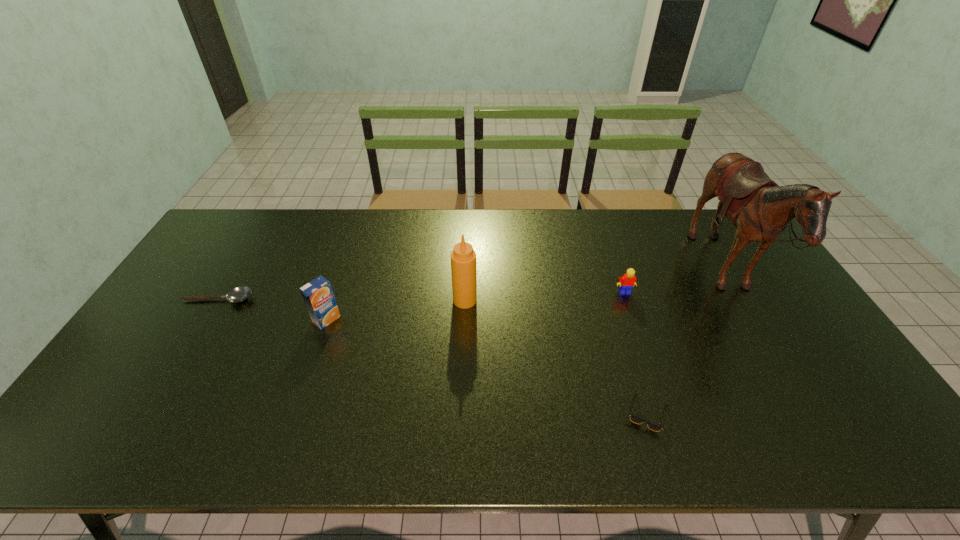
Identify the location of saddle. The height and width of the screenshot is (540, 960). (760, 209).

Find the location of a particular element. The width and height of the screenshot is (960, 540). the rightmost object is located at coordinates (760, 209).

In order to click on condiment in this screenshot , I will do `click(463, 258)`.

Locate an element on the screen. The height and width of the screenshot is (540, 960). the second tallest object is located at coordinates (463, 258).

The image size is (960, 540). Find the location of `the third tallest object`. the third tallest object is located at coordinates (x=318, y=295).

The image size is (960, 540). In order to click on the second object from left to right in this screenshot , I will do `click(318, 295)`.

At what (x,y) coordinates should I click in order to perform the action: click on Lego. Please return your answer as a coordinate pair (x, y). This screenshot has width=960, height=540. Looking at the image, I should click on (627, 281).

In order to click on the fifth tallest object in this screenshot , I will do `click(635, 419)`.

Identify the location of the nearest object. The image size is (960, 540). (635, 419).

Where is `the leftmost object`? This screenshot has width=960, height=540. the leftmost object is located at coordinates (238, 294).